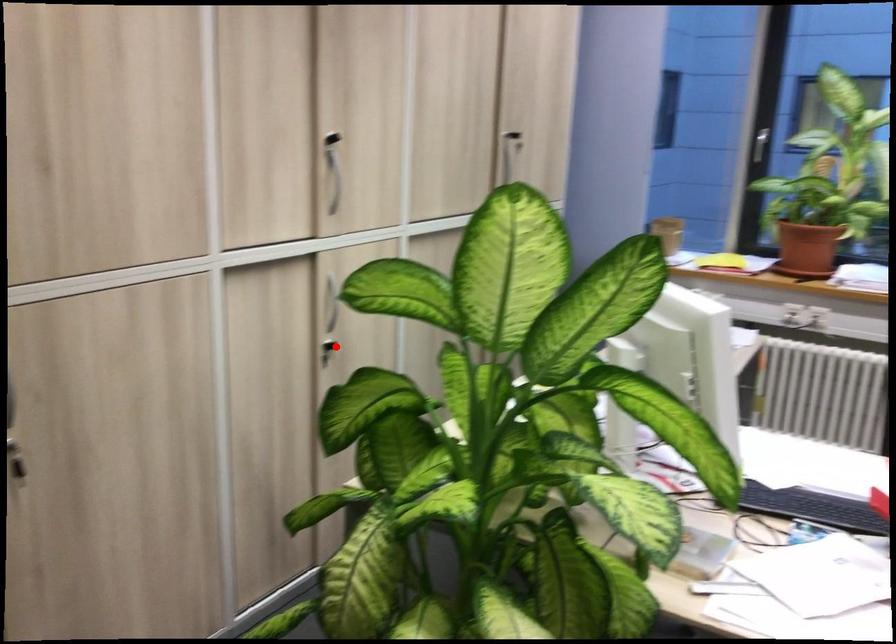
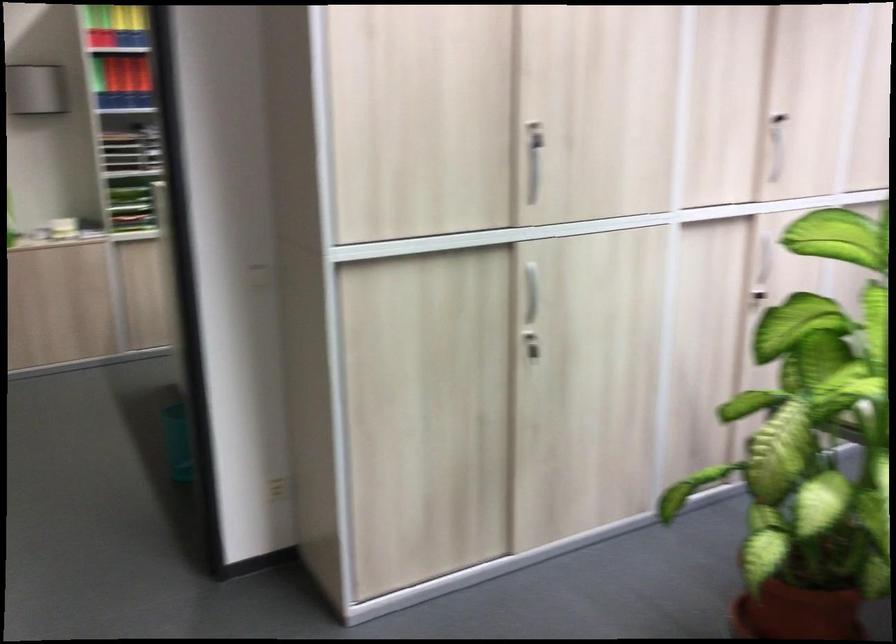
Question: I am providing you with two images of the same scene from different viewpoints. In image1, a red point is highlighted. Considering the same 3D point in image2, which of the following is correct?

Choices:
 (A) It is closer
 (B) It is farther

Answer: (B)